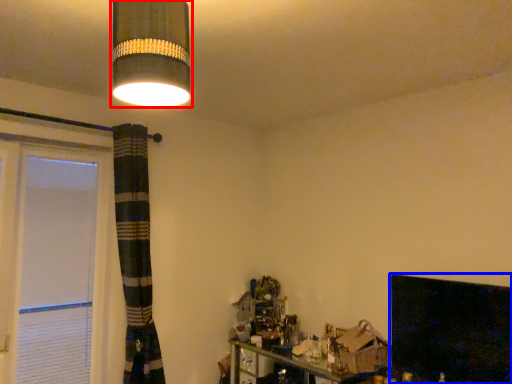
Question: Which of the following is the farthest to the observer, lamp (highlighted by a red box) or fireplace (highlighted by a blue box)?

Choices:
 (A) lamp
 (B) fireplace

Answer: (B)